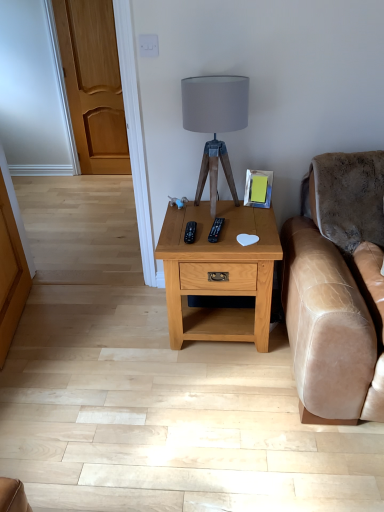
The width and height of the screenshot is (384, 512). What are the coordinates of `vacant space positioned to the left of light brown wood nightstand at center` in the screenshot? It's located at [x=127, y=332].